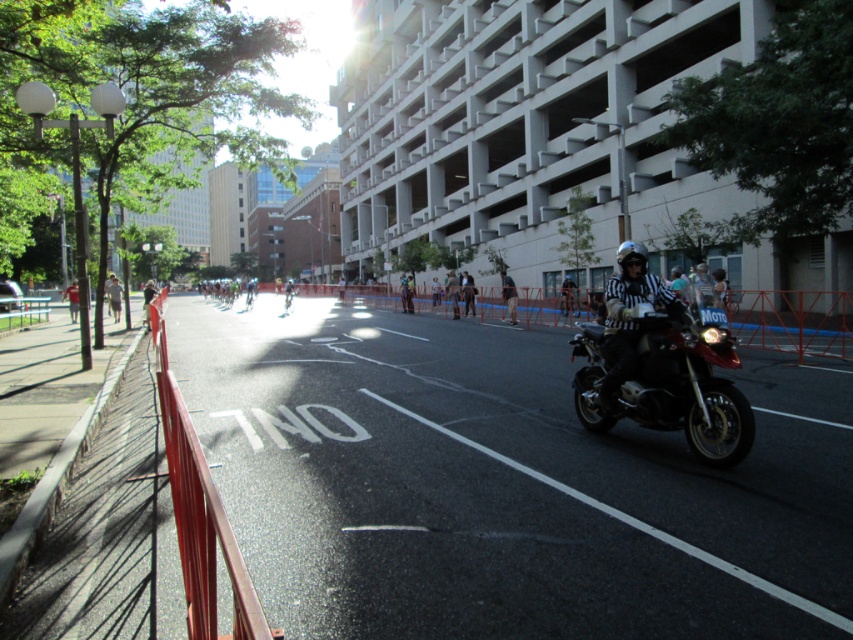
You are a photographer positioned at the starting line of the cycling event. You need to capture a photo that includes both the white striped shirt at right and the white shirt at center. Which shirt should you focus on first to ensure both are in frame?

You should focus on the white striped shirt at right first because its width is larger than the white shirt at center, so it will occupy more space in the photo and ensure both are visible.

You are a cyclist participating in the race and you see the shiny black motorcycle at right and the white striped shirt at right. Which object is nearer to you?

The shiny black motorcycle at right is closer to the viewer than the white striped shirt at right, so the shiny black motorcycle at right is nearer to you.

You are a participant in the cycling event and need to locate the race official. Based on the scene description, where is the black leather helmet at center positioned relative to the motorcyclist?

The black leather helmet at center is worn by the motorcyclist, so it is positioned on their head.